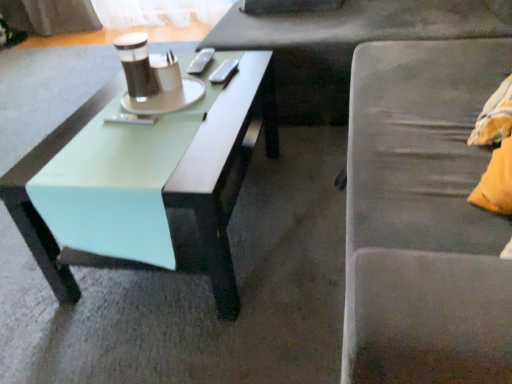
Question: Is matte black remote control at center, the 1th remote control viewed from the front, spatially inside metallic silver remote control at center, which ranks as the first remote control in top-to-bottom order, or outside of it?

Choices:
 (A) outside
 (B) inside

Answer: (A)

Question: From a real-world perspective, is matte black remote control at center, positioned as the third remote control in right-to-left order, physically located above or below metallic silver remote control at center, which appears as the 2th remote control when viewed from the left?

Choices:
 (A) below
 (B) above

Answer: (A)

Question: Which object is positioned closest to the silver metallic remote control at center, which is the second remote control from front to back?

Choices:
 (A) matte black remote control at center, the 1th remote control viewed from the front
 (B) metallic silver remote control at center, placed as the third remote control when sorted from bottom to top
 (C) mint green wood coffee table at left
 (D) matte black cup at center

Answer: (B)

Question: Which object is the closest to the metallic silver remote control at center, which ranks as the first remote control in top-to-bottom order?

Choices:
 (A) matte black remote control at center, arranged as the 1th remote control when ordered from the bottom
 (B) silver metallic remote control at center, which is the second remote control from front to back
 (C) matte black cup at center
 (D) mint green wood coffee table at left

Answer: (B)